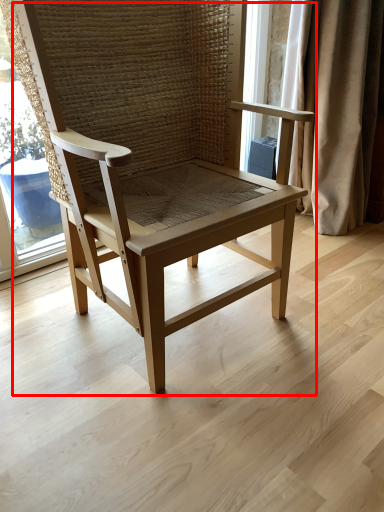
Question: From the image, what is the correct spatial relationship of chair (annotated by the red box) in relation to curtain?

Choices:
 (A) right
 (B) left

Answer: (B)